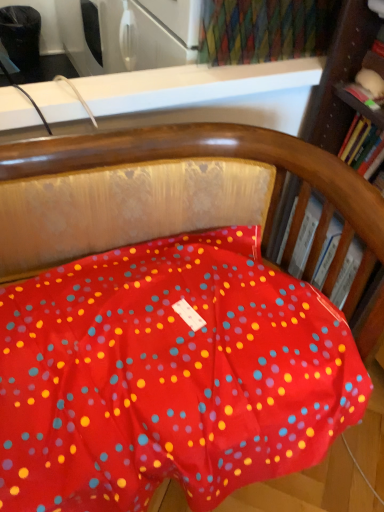
Locate an element on the screen. This screenshot has height=512, width=384. hardcover book at right, positioned as the first book in top-to-bottom order is located at coordinates (361, 144).

The height and width of the screenshot is (512, 384). Describe the element at coordinates (361, 144) in the screenshot. I see `hardcover book at right, positioned as the first book in top-to-bottom order` at that location.

Measure the distance between hardcover book at right, acting as the 2th book starting from the bottom, and camera.

hardcover book at right, acting as the 2th book starting from the bottom, and camera are 33.52 inches apart from each other.

The height and width of the screenshot is (512, 384). Describe the element at coordinates (305, 237) in the screenshot. I see `hardcover book at right, the 1th book positioned from the bottom` at that location.

Locate an element on the screen. This screenshot has height=512, width=384. hardcover book at right, arranged as the 2th book when viewed from the top is located at coordinates (305, 237).

Image resolution: width=384 pixels, height=512 pixels. What are the coordinates of `hardcover book at right, acting as the 2th book starting from the bottom` in the screenshot? It's located at (361, 144).

Is hardcover book at right, positioned as the first book in top-to-bottom order, at the left side of hardcover book at right, arranged as the 2th book when viewed from the top?

No, hardcover book at right, positioned as the first book in top-to-bottom order, is not to the left of hardcover book at right, arranged as the 2th book when viewed from the top.

Which object is further away from the camera, hardcover book at right, acting as the 2th book starting from the bottom, or hardcover book at right, the 1th book positioned from the bottom?

hardcover book at right, the 1th book positioned from the bottom, is more distant.

Is point (368, 160) less distant than point (313, 226)?

Yes, point (368, 160) is in front of point (313, 226).

From the image's perspective, is hardcover book at right, positioned as the first book in top-to-bottom order, positioned above or below hardcover book at right, arranged as the 2th book when viewed from the top?

hardcover book at right, positioned as the first book in top-to-bottom order, is situated higher than hardcover book at right, arranged as the 2th book when viewed from the top, in the image.

From a real-world perspective, is hardcover book at right, positioned as the first book in top-to-bottom order, over hardcover book at right, arranged as the 2th book when viewed from the top?

Yes, from a real-world perspective, hardcover book at right, positioned as the first book in top-to-bottom order, is over hardcover book at right, arranged as the 2th book when viewed from the top

Looking at their sizes, would you say hardcover book at right, positioned as the first book in top-to-bottom order, is wider or thinner than hardcover book at right, arranged as the 2th book when viewed from the top?

hardcover book at right, positioned as the first book in top-to-bottom order, is thinner than hardcover book at right, arranged as the 2th book when viewed from the top.

Considering the sizes of objects hardcover book at right, positioned as the first book in top-to-bottom order, and hardcover book at right, the 1th book positioned from the bottom, in the image provided, who is shorter, hardcover book at right, positioned as the first book in top-to-bottom order, or hardcover book at right, the 1th book positioned from the bottom,?

hardcover book at right, positioned as the first book in top-to-bottom order.

Who is bigger, hardcover book at right, positioned as the first book in top-to-bottom order, or hardcover book at right, arranged as the 2th book when viewed from the top?

With larger size is hardcover book at right, arranged as the 2th book when viewed from the top.

Can we say hardcover book at right, acting as the 2th book starting from the bottom, lies outside hardcover book at right, arranged as the 2th book when viewed from the top?

Yes, hardcover book at right, acting as the 2th book starting from the bottom, is located beyond the bounds of hardcover book at right, arranged as the 2th book when viewed from the top.

Is hardcover book at right, positioned as the first book in top-to-bottom order, far away from hardcover book at right, the 1th book positioned from the bottom?

hardcover book at right, positioned as the first book in top-to-bottom order, is near hardcover book at right, the 1th book positioned from the bottom, not far away.

Is hardcover book at right, positioned as the first book in top-to-bottom order, facing away from hardcover book at right, arranged as the 2th book when viewed from the top?

hardcover book at right, positioned as the first book in top-to-bottom order, does not have its back to hardcover book at right, arranged as the 2th book when viewed from the top.

Based on the photo, measure the distance from hardcover book at right, acting as the 2th book starting from the bottom, to hardcover book at right, arranged as the 2th book when viewed from the top.

A distance of 8.76 inches exists between hardcover book at right, acting as the 2th book starting from the bottom, and hardcover book at right, arranged as the 2th book when viewed from the top.

At what (x,y) coordinates should I click in order to perform the action: click on book above the hardcover book at right, arranged as the 2th book when viewed from the top (from a real-world perspective). Please return your answer as a coordinate pair (x, y). Image resolution: width=384 pixels, height=512 pixels. Looking at the image, I should click on (361, 144).

Can you confirm if hardcover book at right, the 1th book positioned from the bottom, is positioned to the right of hardcover book at right, positioned as the first book in top-to-bottom order?

Incorrect, hardcover book at right, the 1th book positioned from the bottom, is not on the right side of hardcover book at right, positioned as the first book in top-to-bottom order.

Which object is further away from the camera taking this photo, hardcover book at right, the 1th book positioned from the bottom, or hardcover book at right, positioned as the first book in top-to-bottom order?

Positioned behind is hardcover book at right, the 1th book positioned from the bottom.

From the picture: Which point is more distant from viewer, [321,277] or [360,141]?

The point [360,141] is more distant.

From the image's perspective, which object appears higher, hardcover book at right, the 1th book positioned from the bottom, or hardcover book at right, positioned as the first book in top-to-bottom order?

hardcover book at right, positioned as the first book in top-to-bottom order, is shown above in the image.

From the picture: From a real-world perspective, is hardcover book at right, arranged as the 2th book when viewed from the top, physically located above or below hardcover book at right, acting as the 2th book starting from the bottom?

hardcover book at right, arranged as the 2th book when viewed from the top, is below hardcover book at right, acting as the 2th book starting from the bottom.

Which object is thinner, hardcover book at right, arranged as the 2th book when viewed from the top, or hardcover book at right, positioned as the first book in top-to-bottom order?

With smaller width is hardcover book at right, positioned as the first book in top-to-bottom order.

Considering the relative sizes of hardcover book at right, the 1th book positioned from the bottom, and hardcover book at right, positioned as the first book in top-to-bottom order, in the image provided, is hardcover book at right, the 1th book positioned from the bottom, taller than hardcover book at right, positioned as the first book in top-to-bottom order,?

Yes, hardcover book at right, the 1th book positioned from the bottom, is taller than hardcover book at right, positioned as the first book in top-to-bottom order.

Does hardcover book at right, the 1th book positioned from the bottom, have a larger size compared to hardcover book at right, acting as the 2th book starting from the bottom?

Yes.

Can we say hardcover book at right, arranged as the 2th book when viewed from the top, lies outside hardcover book at right, positioned as the first book in top-to-bottom order?

Absolutely, hardcover book at right, arranged as the 2th book when viewed from the top, is external to hardcover book at right, positioned as the first book in top-to-bottom order.

Based on the photo, is hardcover book at right, arranged as the 2th book when viewed from the top, positioned far away from hardcover book at right, acting as the 2th book starting from the bottom?

hardcover book at right, arranged as the 2th book when viewed from the top, is near hardcover book at right, acting as the 2th book starting from the bottom, not far away.

Could you tell me if hardcover book at right, arranged as the 2th book when viewed from the top, is turned towards hardcover book at right, positioned as the first book in top-to-bottom order?

No, hardcover book at right, arranged as the 2th book when viewed from the top, is not turned towards hardcover book at right, positioned as the first book in top-to-bottom order.

How different are the orientations of hardcover book at right, arranged as the 2th book when viewed from the top, and hardcover book at right, positioned as the first book in top-to-bottom order, in degrees?

They differ by 0.00213 degrees in their facing directions.

Locate an element on the screen. The image size is (384, 512). book on the right of hardcover book at right, arranged as the 2th book when viewed from the top is located at coordinates (361, 144).

Where is `book on the left of the hardcover book at right, positioned as the first book in top-to-bottom order`? This screenshot has height=512, width=384. book on the left of the hardcover book at right, positioned as the first book in top-to-bottom order is located at coordinates (305, 237).

Find the location of a particular element. This screenshot has height=512, width=384. book above the hardcover book at right, arranged as the 2th book when viewed from the top (from a real-world perspective) is located at coordinates (361, 144).